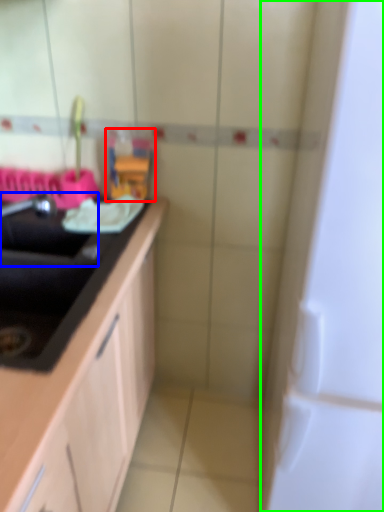
Question: Which object is positioned farthest from toy (highlighted by a red box)? Select from sink (highlighted by a blue box) and appliance (highlighted by a green box).

Choices:
 (A) sink
 (B) appliance

Answer: (B)